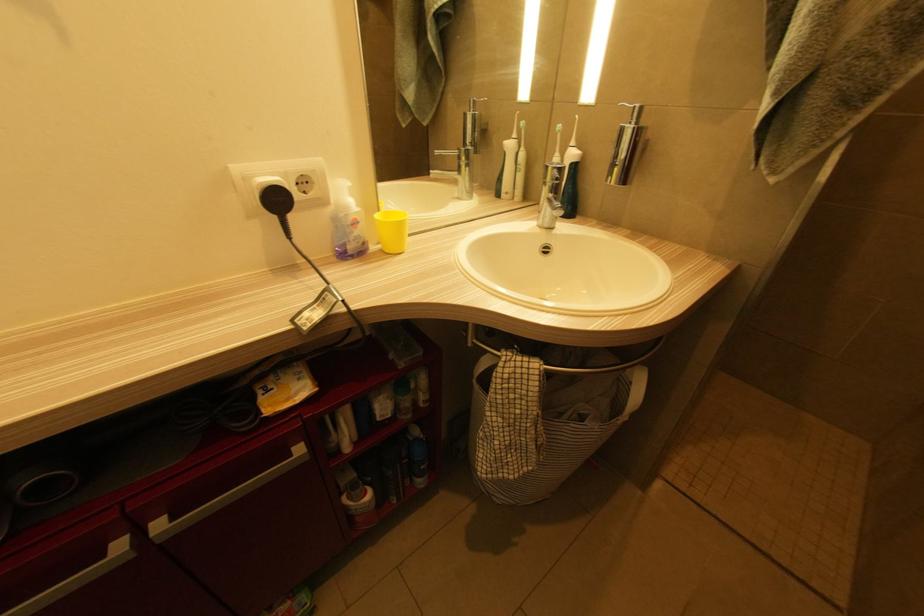
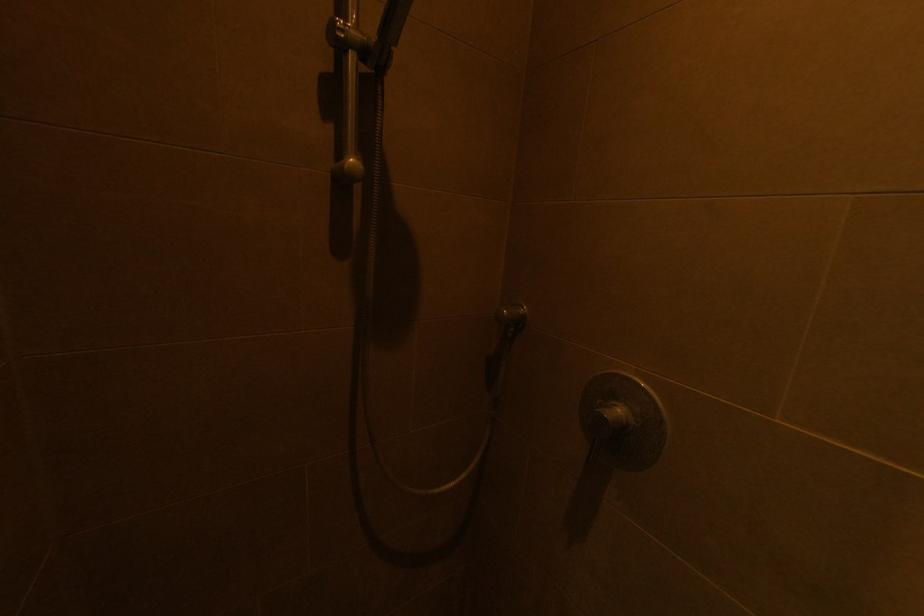
Which direction would the cameraman need to move to produce the second image?

The cameraman moved toward right, forward.